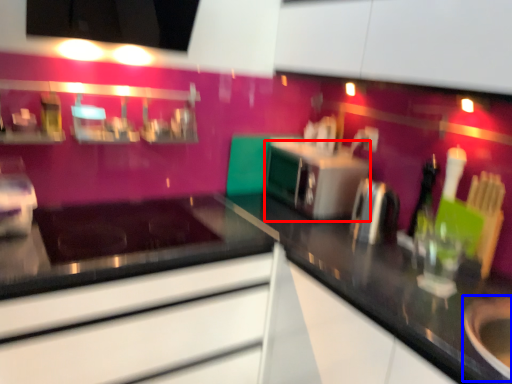
Question: Which of the following is the closest to the observer, oven (highlighted by a red box) or appliance (highlighted by a blue box)?

Choices:
 (A) oven
 (B) appliance

Answer: (B)